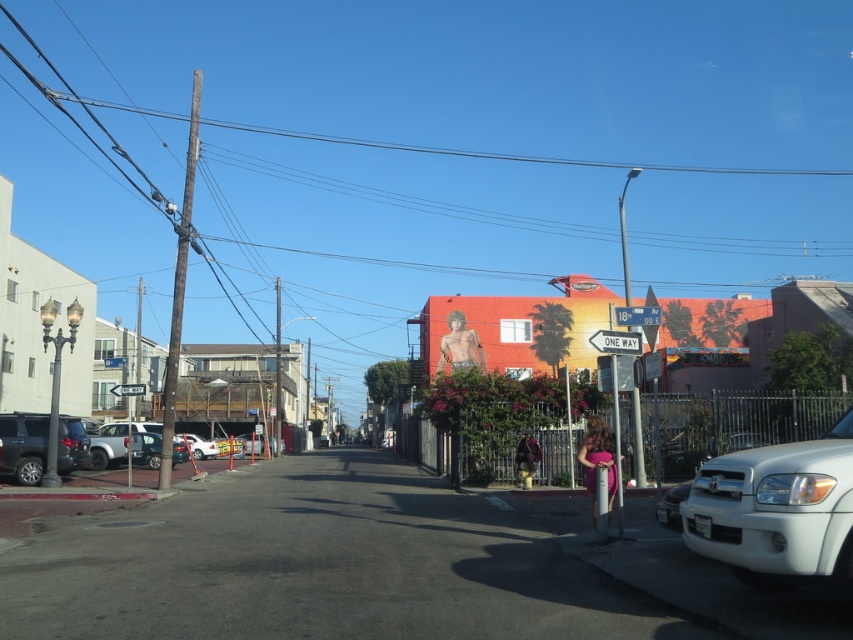
Does metallic blue street sign at upper center have a greater width compared to white plastic street sign at upper center?

In fact, metallic blue street sign at upper center might be narrower than white plastic street sign at upper center.

Describe the element at coordinates (637, 316) in the screenshot. I see `metallic blue street sign at upper center` at that location.

Which is in front, point (660, 314) or point (142, 384)?

Point (660, 314) is in front.

The width and height of the screenshot is (853, 640). I want to click on metallic blue street sign at upper center, so click(x=637, y=316).

Does white matte suv at lower right have a greater width compared to white matte car at center?

Incorrect, white matte suv at lower right's width does not surpass white matte car at center's.

Is white matte suv at lower right smaller than white matte car at center?

Correct, white matte suv at lower right occupies less space than white matte car at center.

Who is more distant from viewer, [796,531] or [198,449]?

Positioned behind is point [198,449].

At what (x,y) coordinates should I click in order to perform the action: click on white matte suv at lower right. Please return your answer as a coordinate pair (x, y). Looking at the image, I should click on (776, 509).

I want to click on white matte car at left, so click(125, 444).

Is white matte car at left to the right of white matte car at center from the viewer's perspective?

Correct, you'll find white matte car at left to the right of white matte car at center.

Which is behind, point (123, 448) or point (209, 456)?

The point (209, 456) is behind.

Locate an element on the screen. white matte car at left is located at coordinates (125, 444).